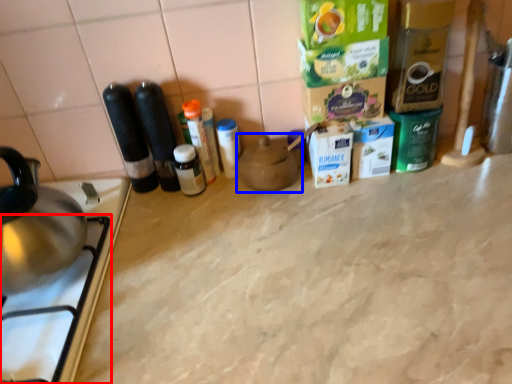
Question: Which of the following is the farthest to the observer, gas stove (highlighted by a red box) or appliance (highlighted by a blue box)?

Choices:
 (A) gas stove
 (B) appliance

Answer: (B)